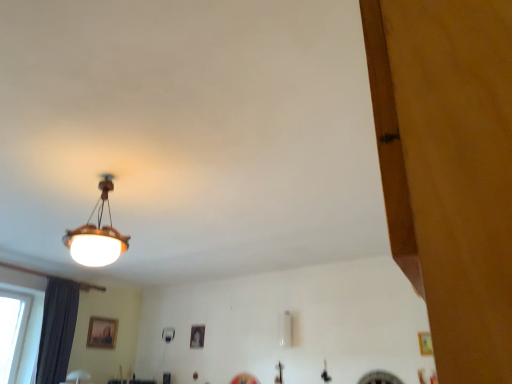
Question: In the image, is dark gray fabric curtain at left positioned in front of or behind matte black picture frame at center, which appears as the 1th picture frame when viewed from the right?

Choices:
 (A) behind
 (B) front

Answer: (B)

Question: Is dark gray fabric curtain at left situated inside matte black picture frame at center, which appears as the 1th picture frame when viewed from the right, or outside?

Choices:
 (A) inside
 (B) outside

Answer: (B)

Question: Based on their relative distances, which object is nearer to the wooden picture frame at lower center, which is the first picture frame in left-to-right order?

Choices:
 (A) dark gray fabric curtain at left
 (B) matte wooden lampshade at upper left
 (C) matte black picture frame at center, the 2th picture frame in the left-to-right sequence

Answer: (C)

Question: Which of these objects is positioned farthest from the matte black picture frame at center, the 2th picture frame in the left-to-right sequence?

Choices:
 (A) dark gray fabric curtain at left
 (B) wooden picture frame at lower center, which is the second picture frame in right-to-left order
 (C) matte wooden lampshade at upper left

Answer: (C)